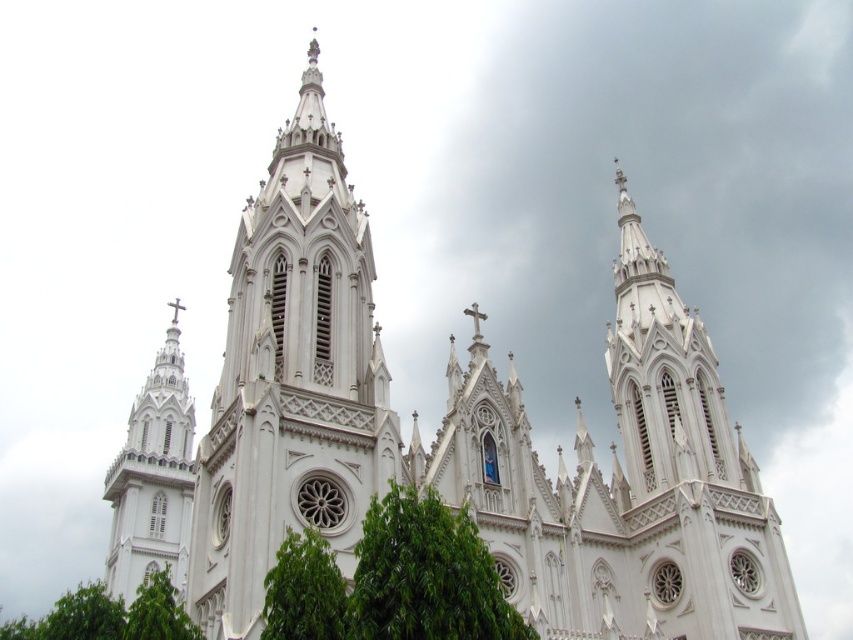
You are standing in front of the church and want to take a photo that includes both the white stone tower at center and the green leafy tree at lower left. Which object should be placed to the right side in your photo composition?

The white stone tower at center is positioned on the right side of green leafy tree at lower left, so in your photo composition, the white stone tower at center should be placed to the right side of the green leafy tree at lower left.

You are standing in front of the church and want to take a photo that includes both the green leafy tree at center and the green leafy tree at lower left. Which tree will appear smaller in the photo?

The green leafy tree at center will appear smaller in the photo because it has a smaller size compared to the green leafy tree at lower left.

You are standing in front of the grand ornate church with Gothic architecture. You notice a point marked at coordinates (293, 380). According to the image, what structure is this point located on?

The point at (293, 380) is located on the white stone church tower at center.